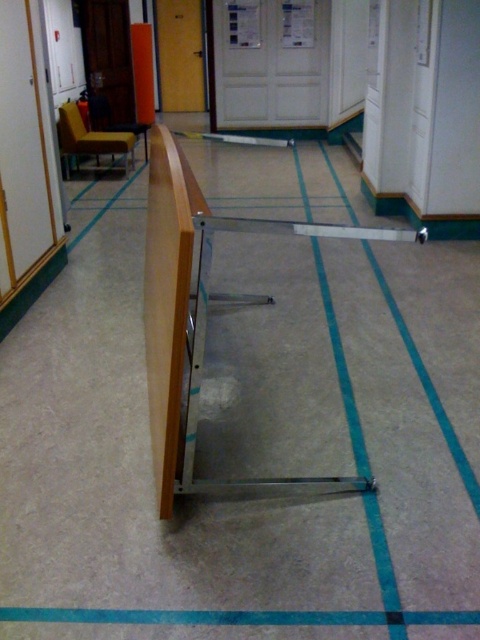
You are a delivery person trying to navigate through the hallway. You need to avoid stepping on the blue fabric strip at lower center and the wooden rail at center. Which one should you avoid stepping on first, considering their sizes?

The wooden rail at center is larger in size than the blue fabric strip at lower center, so you should avoid stepping on the wooden rail at center first because it is bigger and might pose a greater obstacle.

You are a delivery person carrying a long package that is 10 cm thick. You need to place it on the wooden rail at center or the blue fabric strip at lower center. Which surface can accommodate the thickness of your package?

The blue fabric strip at lower center is thicker than the wooden rail at center, so the blue fabric strip at lower center can accommodate the 10 cm thick package since it has sufficient thickness to support it.

You are a delivery person entering the hallway and need to place a large package on the floor. The package is 2 meters tall. Are you able to place it between the wooden rail at center and the blue fabric strip at lower center without hitting the ceiling?

The wooden rail at center is much taller than the blue fabric strip at lower center. Since the package is 2 meters tall, it may hit the wooden rail at center if placed between them. However, the exact height of the ceiling isn